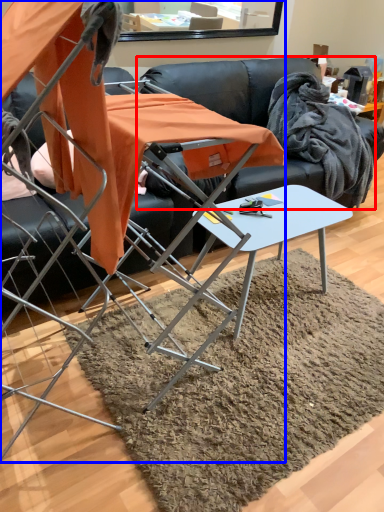
Question: Which point is closer to the camera, couch (highlighted by a red box) or chair (highlighted by a blue box)?

Choices:
 (A) couch
 (B) chair

Answer: (B)